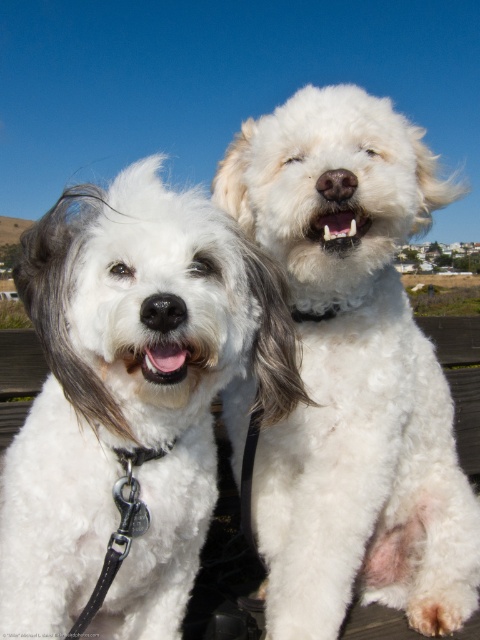
Question: Which point is farther from the camera taking this photo?

Choices:
 (A) (284, 237)
 (B) (37, 538)

Answer: (A)

Question: Which of the following is the closest to the observer?

Choices:
 (A) white fluffy dog at center
 (B) white fluffy dog at right

Answer: (A)

Question: Is white fluffy dog at right wider than white fluffy dog at center?

Choices:
 (A) no
 (B) yes

Answer: (B)

Question: Can you confirm if white fluffy dog at right is positioned to the right of white fluffy dog at center?

Choices:
 (A) no
 (B) yes

Answer: (B)

Question: Is white fluffy dog at right below white fluffy dog at center?

Choices:
 (A) no
 (B) yes

Answer: (A)